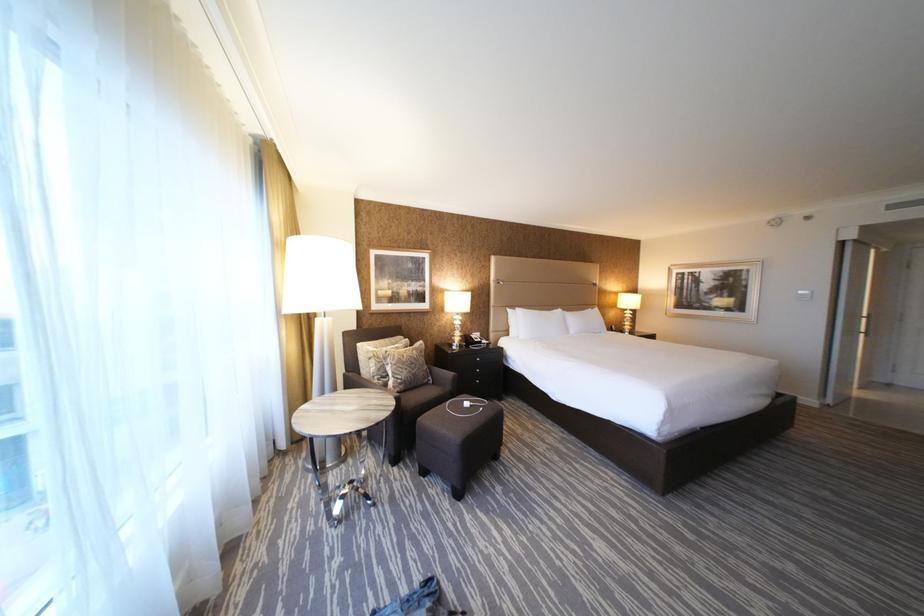
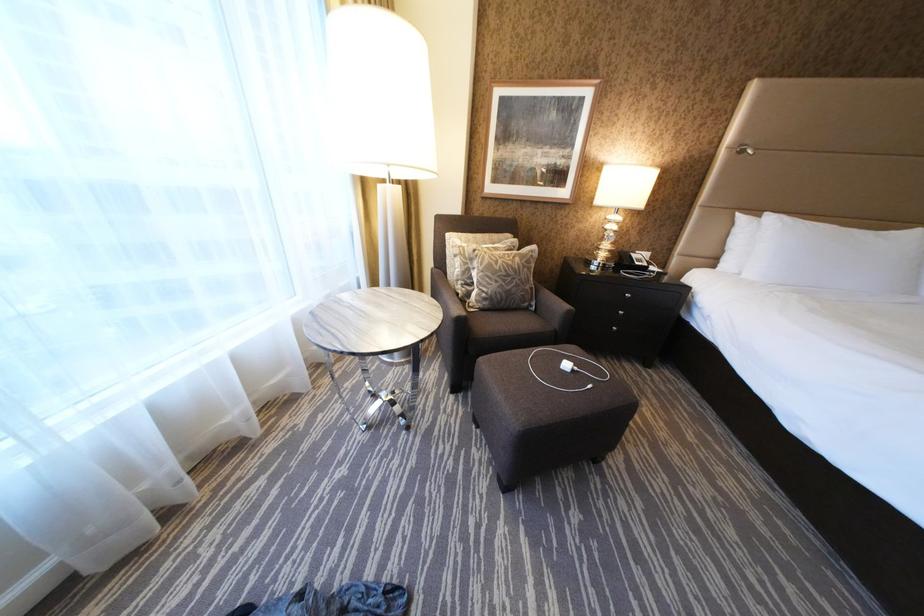
Based on the continuous images, in which direction is the camera rotating?

The camera rotated toward left-down.